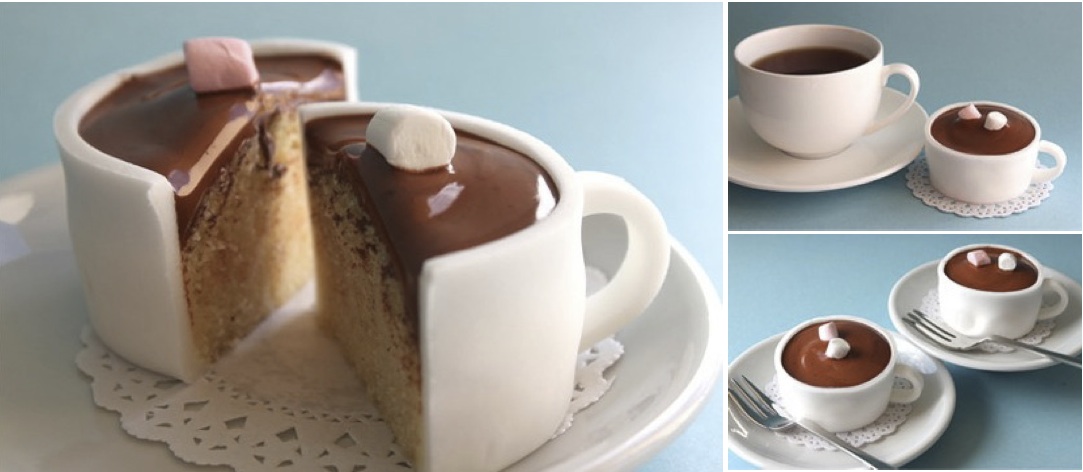
In order to click on handles in this screenshot , I will do `click(643, 252)`, `click(910, 373)`.